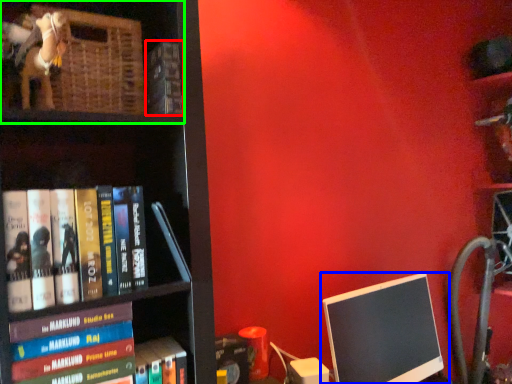
Question: Which object is positioned farthest from book (highlighted by a red box)? Select from computer monitor (highlighted by a blue box) and shelf (highlighted by a green box).

Choices:
 (A) computer monitor
 (B) shelf

Answer: (A)